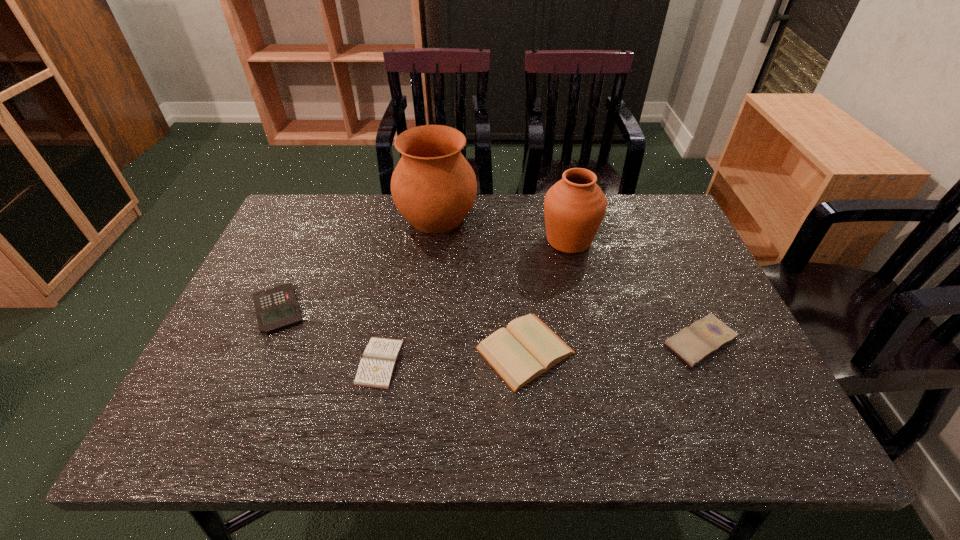
Locate an element on the screen. free space located on the back of the second diary from left to right is located at coordinates (515, 235).

In order to click on blank space located on the back of the calculator in this screenshot , I will do `click(323, 210)`.

Identify the location of blank area located 0.400m on the left of the rightmost diary. (487, 341).

I want to click on vacant position located on the right of the shortest object, so click(x=489, y=362).

This screenshot has width=960, height=540. Identify the location of pottery situated at the far edge. (433, 186).

This screenshot has height=540, width=960. Identify the location of urn that is positioned at the far edge. (574, 207).

Where is `object situated at the left edge`? The height and width of the screenshot is (540, 960). object situated at the left edge is located at coordinates (276, 308).

Locate an element on the screen. object that is at the right edge is located at coordinates (705, 336).

Image resolution: width=960 pixels, height=540 pixels. In the image, there is a desktop. What are the coordinates of `vacant area at the far edge` in the screenshot? It's located at (509, 230).

The height and width of the screenshot is (540, 960). In order to click on vacant space at the near edge in this screenshot , I will do `click(547, 412)`.